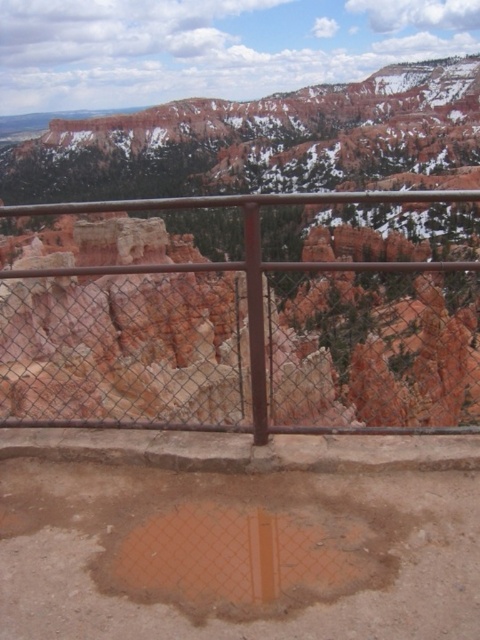
Question: Considering the relative positions of rusty metal fence at center and brown matte puddle at lower center in the image provided, where is rusty metal fence at center located with respect to brown matte puddle at lower center?

Choices:
 (A) left
 (B) right

Answer: (A)

Question: Which object is farther from the camera taking this photo?

Choices:
 (A) rusty metal fence at center
 (B) brown matte puddle at lower center

Answer: (A)

Question: Can you confirm if rusty metal fence at center is smaller than brown matte puddle at lower center?

Choices:
 (A) yes
 (B) no

Answer: (B)

Question: Does rusty metal fence at center appear on the left side of brown matte puddle at lower center?

Choices:
 (A) yes
 (B) no

Answer: (A)

Question: Which object appears closest to the camera in this image?

Choices:
 (A) brown matte puddle at lower center
 (B) rusty metal fence at center

Answer: (A)